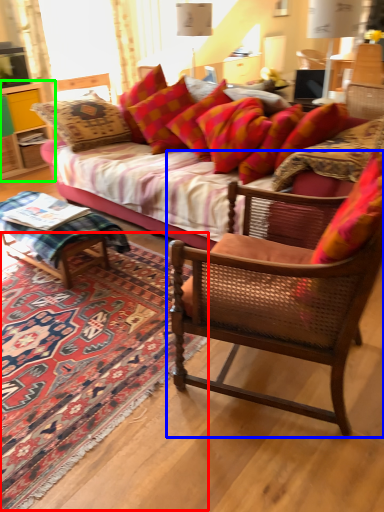
Question: Which object is positioned closest to mat (highlighted by a red box)? Select from chair (highlighted by a blue box) and cabinetry (highlighted by a green box).

Choices:
 (A) chair
 (B) cabinetry

Answer: (A)